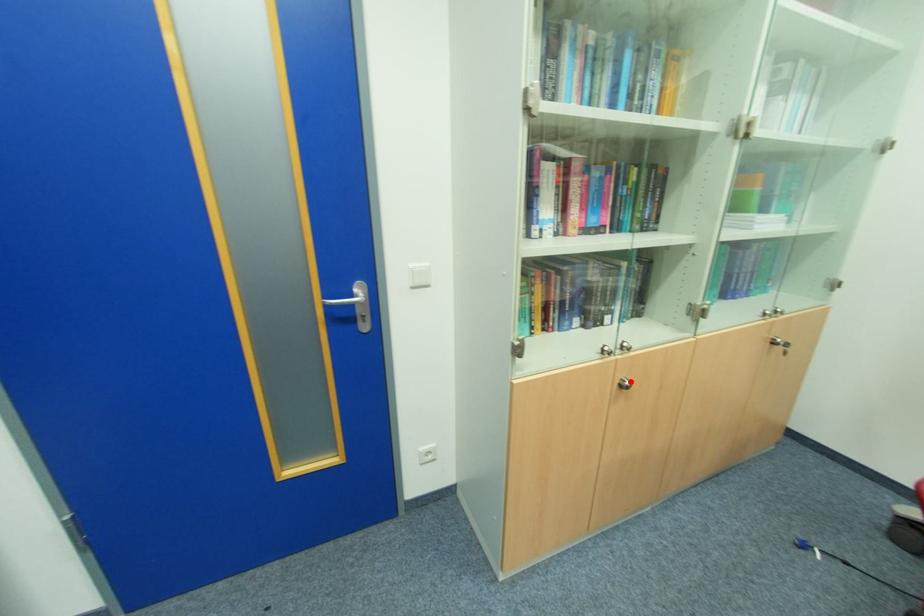
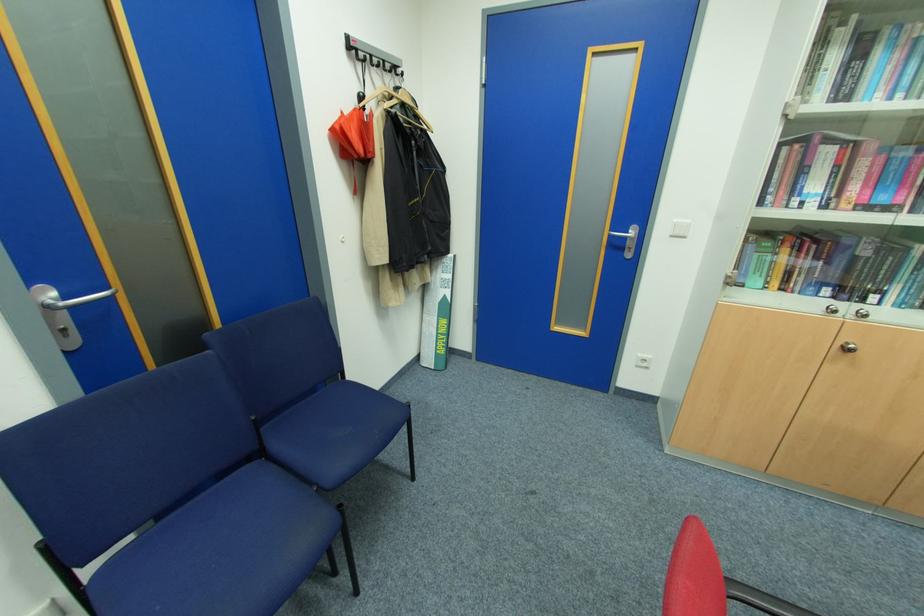
Question: A red point is marked in image1. In image2, is the corresponding 3D point closer to the camera or farther? Reply with the corresponding letter.

Choices:
 (A) The corresponding 3D point is closer.
 (B) The corresponding 3D point is farther.

Answer: (B)